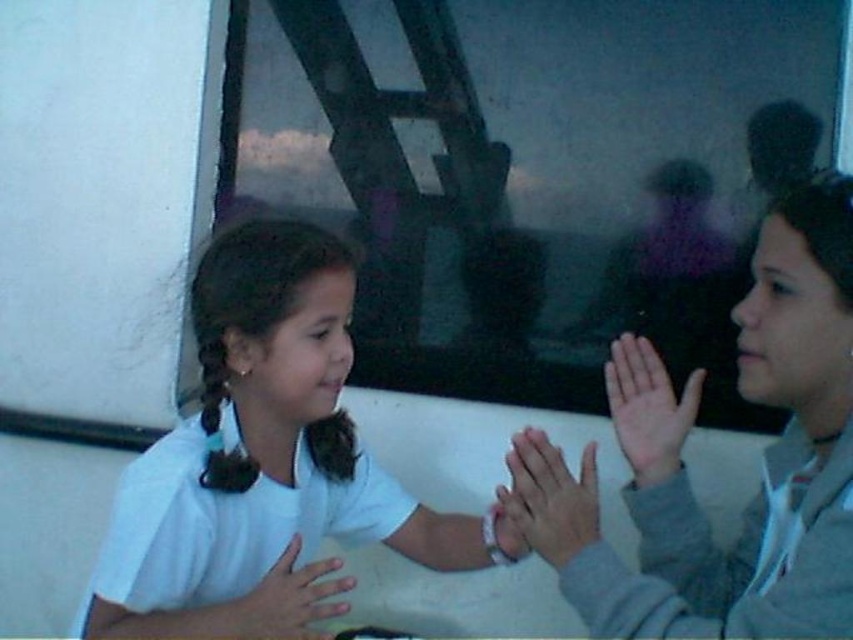
Question: From the image, what is the correct spatial relationship of smooth skin hand at center in relation to smooth white hand at center?

Choices:
 (A) left
 (B) right

Answer: (B)

Question: Can you confirm if white matte shirt at center is bigger than smooth skin hand at center?

Choices:
 (A) yes
 (B) no

Answer: (A)

Question: Which point is farther to the camera?

Choices:
 (A) white matte shirt at center
 (B) smooth skin hands at center
 (C) gray fleece jacket at right
 (D) smooth skin hand at center

Answer: (D)

Question: Which point appears farthest from the camera in this image?

Choices:
 (A) (593, 534)
 (B) (286, 611)
 (C) (849, 465)
 (D) (241, 497)

Answer: (D)

Question: Does white matte shirt at center appear on the right side of gray fleece jacket at right?

Choices:
 (A) no
 (B) yes

Answer: (A)

Question: Which point is farther from the camera taking this photo?

Choices:
 (A) (631, 376)
 (B) (276, 344)
 (C) (625, 488)
 (D) (260, 586)

Answer: (C)